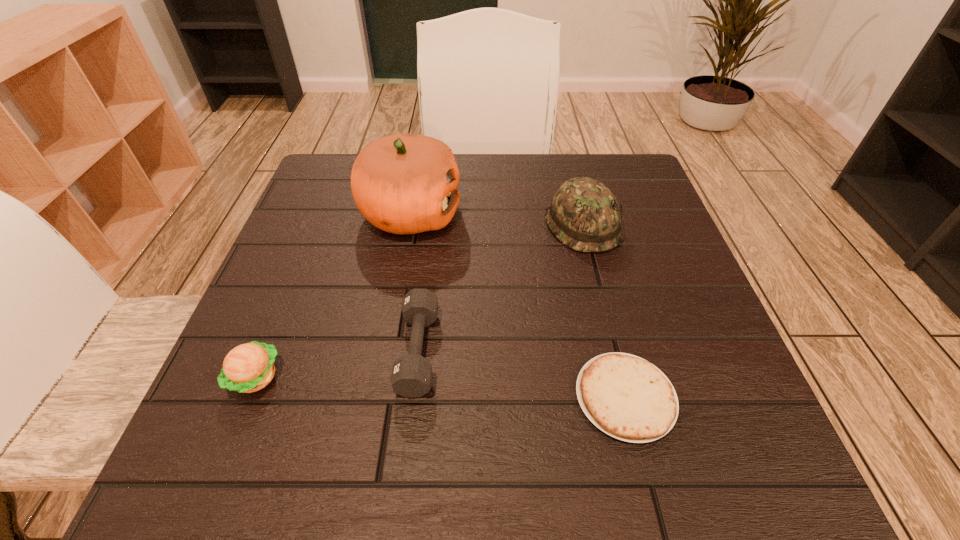
Where is `pumpkin that is at the far edge`? pumpkin that is at the far edge is located at coordinates (406, 184).

Locate an element on the screen. The image size is (960, 540). headwear at the far edge is located at coordinates (584, 215).

Image resolution: width=960 pixels, height=540 pixels. I want to click on object present at the near edge, so click(x=625, y=396).

I want to click on pumpkin located in the left edge section of the desktop, so click(x=406, y=184).

I want to click on hamburger located at the left edge, so click(x=247, y=368).

You are a GUI agent. You are given a task and a screenshot of the screen. Output one action in this format:
    pyautogui.click(x=<x>, y=<y>)
    Task: Click on the headwear located in the right edge section of the desktop
    The image size is (960, 540).
    Given the screenshot: What is the action you would take?
    pyautogui.click(x=584, y=215)

This screenshot has height=540, width=960. Identify the location of tortilla located in the right edge section of the desktop. (625, 396).

The image size is (960, 540). I want to click on object that is at the far left corner, so click(x=406, y=184).

Locate an element on the screen. object that is at the far right corner is located at coordinates (584, 215).

Where is `object located in the near right corner section of the desktop`? object located in the near right corner section of the desktop is located at coordinates (625, 396).